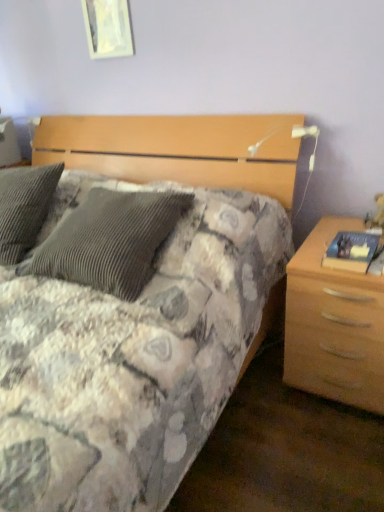
Question: Does white glossy picture frame at upper center have a lesser height compared to light wood/texture nightstand at right?

Choices:
 (A) yes
 (B) no

Answer: (A)

Question: From the image's perspective, would you say white glossy picture frame at upper center is shown under light wood/texture nightstand at right?

Choices:
 (A) yes
 (B) no

Answer: (B)

Question: Is white glossy picture frame at upper center turned away from light wood/texture nightstand at right?

Choices:
 (A) no
 (B) yes

Answer: (A)

Question: From a real-world perspective, does white glossy picture frame at upper center sit lower than light wood/texture nightstand at right?

Choices:
 (A) no
 (B) yes

Answer: (A)

Question: Are white glossy picture frame at upper center and light wood/texture nightstand at right far apart?

Choices:
 (A) no
 (B) yes

Answer: (B)

Question: Can you confirm if white glossy picture frame at upper center is taller than light wood/texture nightstand at right?

Choices:
 (A) no
 (B) yes

Answer: (A)

Question: Is light wood/texture nightstand at right at the left side of white glossy picture frame at upper center?

Choices:
 (A) no
 (B) yes

Answer: (A)

Question: Considering the relative sizes of light wood/texture nightstand at right and white glossy picture frame at upper center in the image provided, is light wood/texture nightstand at right shorter than white glossy picture frame at upper center?

Choices:
 (A) yes
 (B) no

Answer: (B)

Question: Is light wood/texture nightstand at right behind white glossy picture frame at upper center?

Choices:
 (A) yes
 (B) no

Answer: (B)

Question: Is light wood/texture nightstand at right closer to the viewer compared to white glossy picture frame at upper center?

Choices:
 (A) no
 (B) yes

Answer: (B)

Question: Is light wood/texture nightstand at right facing away from white glossy picture frame at upper center?

Choices:
 (A) no
 (B) yes

Answer: (A)

Question: Can white glossy picture frame at upper center be found inside light wood/texture nightstand at right?

Choices:
 (A) no
 (B) yes

Answer: (A)

Question: From a real-world perspective, is white glossy picture frame at upper center positioned above or below light wood/texture nightstand at right?

Choices:
 (A) below
 (B) above

Answer: (B)